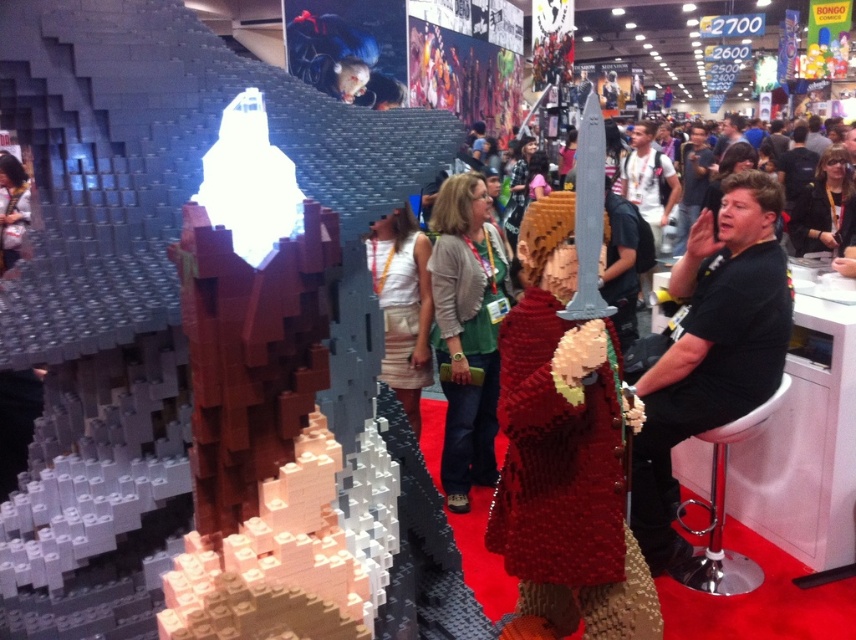
Question: Can you confirm if red brick armor at center is smaller than black matte shirt at right?

Choices:
 (A) no
 (B) yes

Answer: (B)

Question: Is black matte shirt at right to the right of green fabric jacket at center from the viewer's perspective?

Choices:
 (A) yes
 (B) no

Answer: (A)

Question: Among these objects, which one is farthest from the camera?

Choices:
 (A) black matte shirt at right
 (B) white fabric skirt at center
 (C) red brick armor at center
 (D) green fabric jacket at center

Answer: (B)

Question: Among these objects, which one is farthest from the camera?

Choices:
 (A) black matte shirt at right
 (B) green fabric jacket at center
 (C) white fabric skirt at center
 (D) red brick armor at center

Answer: (C)

Question: Can you confirm if red brick armor at center is positioned below black matte shirt at right?

Choices:
 (A) no
 (B) yes

Answer: (B)

Question: Which point is closer to the camera?

Choices:
 (A) red brick armor at center
 (B) green fabric jacket at center
 (C) white fabric skirt at center

Answer: (A)